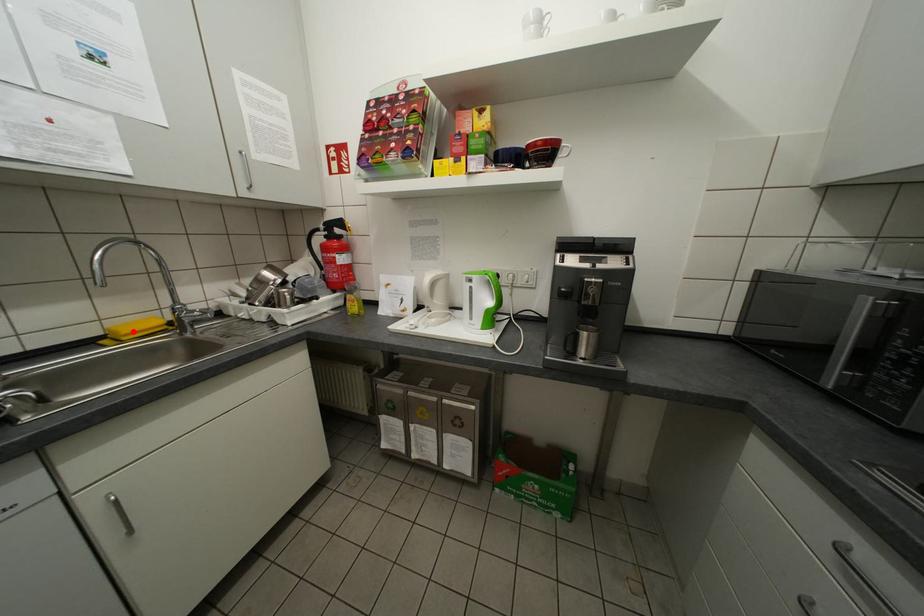
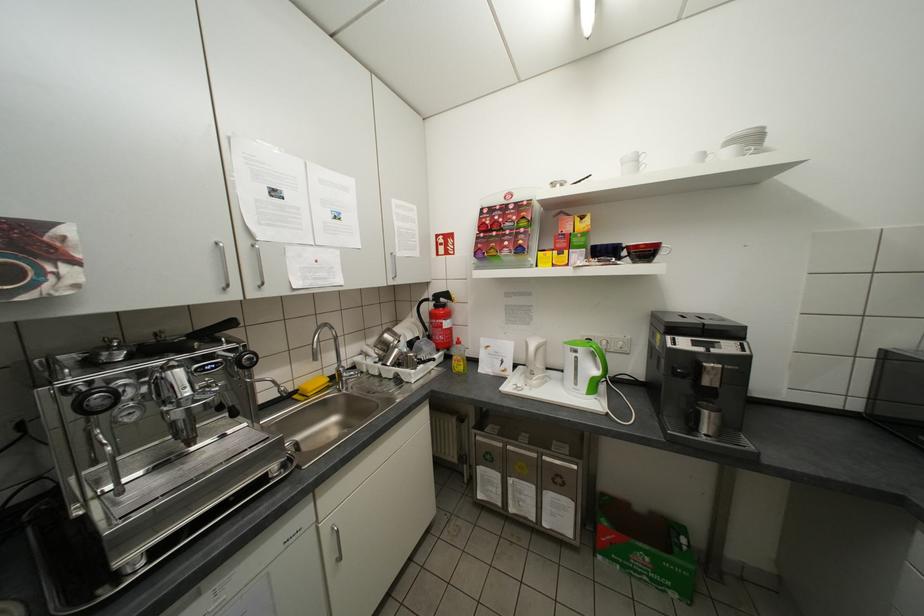
Where in the second image is the point corresponding to the highlighted location from the first image?

(319, 389)